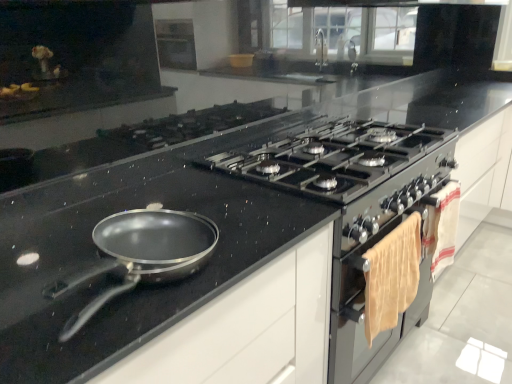
Question: From a real-world perspective, is matte silver oven at right located higher than black glass gas stove at center?

Choices:
 (A) yes
 (B) no

Answer: (B)

Question: Is matte silver oven at right wider than black glass gas stove at center?

Choices:
 (A) yes
 (B) no

Answer: (B)

Question: From the image's perspective, would you say matte silver oven at right is shown under black glass gas stove at center?

Choices:
 (A) no
 (B) yes

Answer: (B)

Question: Is matte silver oven at right not inside black glass gas stove at center?

Choices:
 (A) no
 (B) yes

Answer: (B)

Question: From the image's perspective, is matte silver oven at right above black glass gas stove at center?

Choices:
 (A) yes
 (B) no

Answer: (B)

Question: Would you say black glass gas stove at center is to the left or to the right of white cotton towel at right in the picture?

Choices:
 (A) left
 (B) right

Answer: (A)

Question: From a real-world perspective, is black glass gas stove at center physically located above or below white cotton towel at right?

Choices:
 (A) above
 (B) below

Answer: (A)

Question: Does point (335, 132) appear closer or farther from the camera than point (437, 273)?

Choices:
 (A) farther
 (B) closer

Answer: (B)

Question: Considering the positions of black glass gas stove at center and white cotton towel at right in the image, is black glass gas stove at center wider or thinner than white cotton towel at right?

Choices:
 (A) wide
 (B) thin

Answer: (A)

Question: In terms of height, does white cotton towel at right look taller or shorter compared to matte silver oven at right?

Choices:
 (A) tall
 (B) short

Answer: (A)

Question: Looking at the image, does white cotton towel at right seem bigger or smaller compared to matte silver oven at right?

Choices:
 (A) small
 (B) big

Answer: (A)

Question: In the image, is white cotton towel at right on the left side or the right side of matte silver oven at right?

Choices:
 (A) right
 (B) left

Answer: (A)

Question: From the image's perspective, relative to matte silver oven at right, is white cotton towel at right above or below?

Choices:
 (A) below
 (B) above

Answer: (B)

Question: Does point (450, 226) appear closer or farther from the camera than point (181, 359)?

Choices:
 (A) farther
 (B) closer

Answer: (A)

Question: Is white cotton towel at right spatially inside matte black countertop at center, or outside of it?

Choices:
 (A) inside
 (B) outside

Answer: (B)